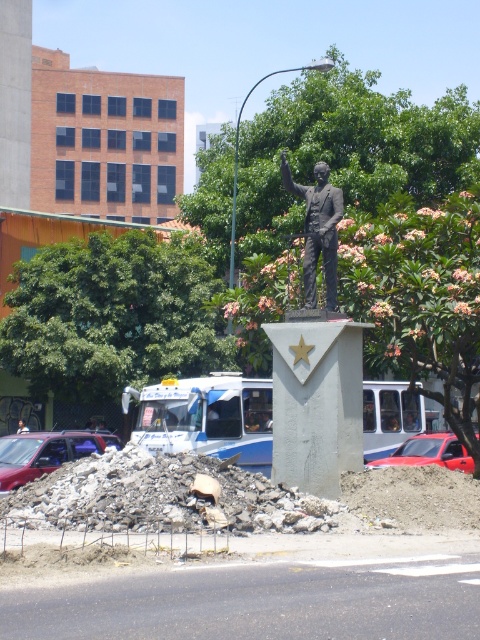
Question: Does rubble concrete at center lie in front of blurred plastic man at center?

Choices:
 (A) no
 (B) yes

Answer: (B)

Question: Estimate the real-world distances between objects in this image. Which object is closer to the rubble concrete at center?

Choices:
 (A) shiny red car at center
 (B) bronze statue at center
 (C) matte red car at lower left

Answer: (B)

Question: Estimate the real-world distances between objects in this image. Which object is closer to the shiny red car at center?

Choices:
 (A) rubble concrete at center
 (B) matte red car at lower left

Answer: (B)

Question: Considering the relative positions of shiny red car at center and blurred plastic man at center in the image provided, where is shiny red car at center located with respect to blurred plastic man at center?

Choices:
 (A) below
 (B) above

Answer: (B)

Question: Considering the relative positions of shiny red car at center and blurred plastic man at center in the image provided, where is shiny red car at center located with respect to blurred plastic man at center?

Choices:
 (A) above
 (B) below

Answer: (A)

Question: Which object is farther from the camera taking this photo?

Choices:
 (A) matte red car at lower left
 (B) bronze statue at center
 (C) rubble concrete at center

Answer: (A)